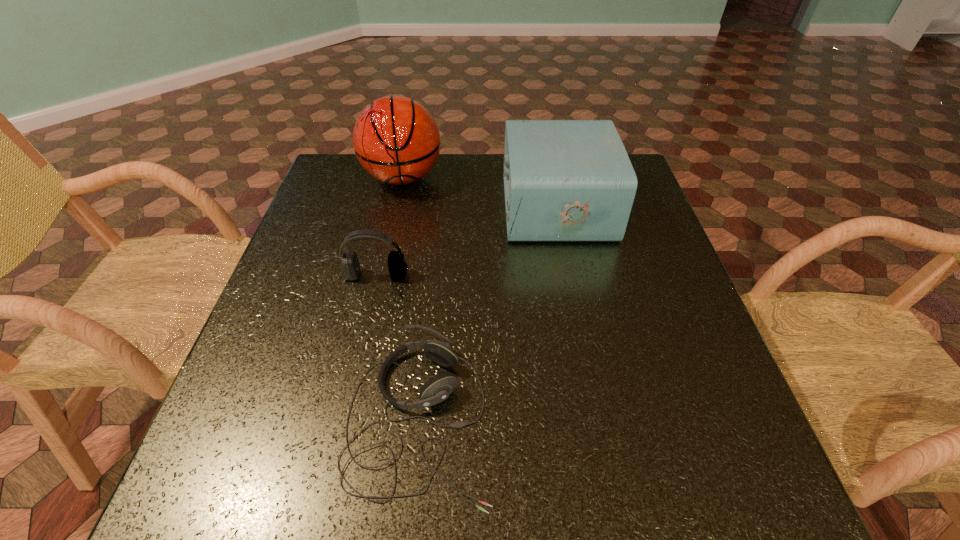
At what (x,y) coordinates should I click in order to perform the action: click on empty space that is in between the farther headset and the shortest object. Please return your answer as a coordinate pair (x, y). The height and width of the screenshot is (540, 960). Looking at the image, I should click on (397, 347).

What are the coordinates of `free space between the radio receiver and the shorter headset` in the screenshot? It's located at (488, 313).

Identify the location of vacant region between the third tallest object and the third shortest object. Image resolution: width=960 pixels, height=540 pixels. (466, 241).

In order to click on free space between the shorter headset and the farther headset in this screenshot , I will do (x=397, y=347).

The image size is (960, 540). I want to click on empty location between the radio receiver and the nearer headset, so click(x=488, y=313).

At what (x,y) coordinates should I click in order to perform the action: click on empty space that is in between the third shortest object and the shorter headset. Please return your answer as a coordinate pair (x, y). The width and height of the screenshot is (960, 540). Looking at the image, I should click on (488, 313).

At what (x,y) coordinates should I click in order to perform the action: click on object that is the closest to the nearer headset. Please return your answer as a coordinate pair (x, y). This screenshot has width=960, height=540. Looking at the image, I should click on (350, 268).

This screenshot has height=540, width=960. I want to click on object that ranks as the second closest to the radio receiver, so click(x=350, y=268).

Find the location of `vacant area in the image that satisfies the following two spatial constraints: 1. on the front panel of the radio receiver; 2. on the headband of the third tallest object`. vacant area in the image that satisfies the following two spatial constraints: 1. on the front panel of the radio receiver; 2. on the headband of the third tallest object is located at coordinates (569, 275).

This screenshot has height=540, width=960. I want to click on vacant space that satisfies the following two spatial constraints: 1. on the front panel of the radio receiver; 2. on the headband of the taller headset, so click(569, 275).